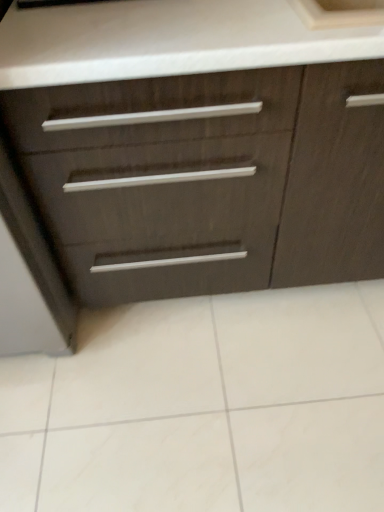
This screenshot has height=512, width=384. I want to click on matte brown cabinet at center, so click(x=198, y=145).

What do you see at coordinates (198, 145) in the screenshot?
I see `matte brown cabinet at center` at bounding box center [198, 145].

Locate an element on the screen. The height and width of the screenshot is (512, 384). matte brown cabinet at center is located at coordinates 198,145.